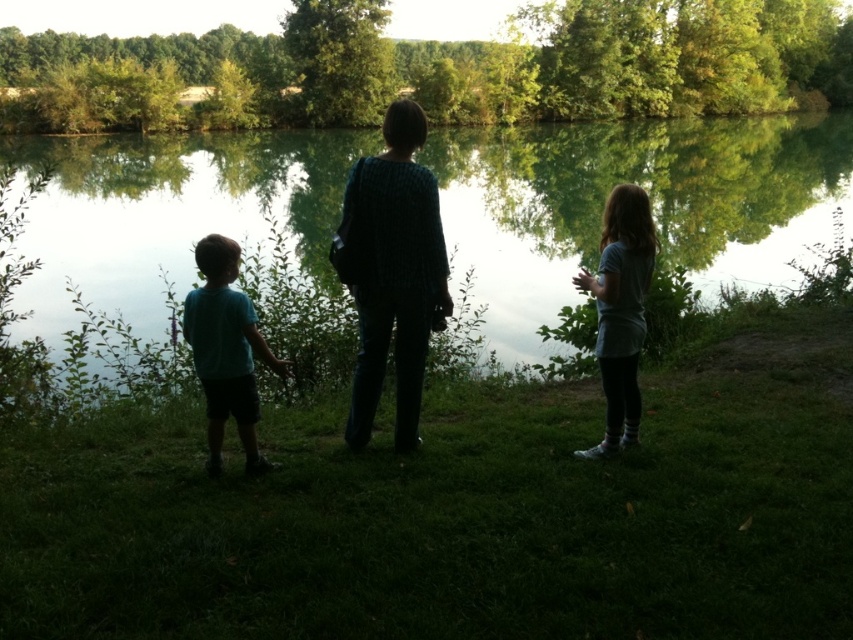
Question: Which object appears closest to the camera in this image?

Choices:
 (A) green reflective water at center
 (B) dark green textured sweater at center
 (C) matte teal shirt at left

Answer: (C)

Question: Is green reflective water at center to the left of dark green textured sweater at center from the viewer's perspective?

Choices:
 (A) no
 (B) yes

Answer: (B)

Question: Can you confirm if green reflective water at center is positioned to the left of dark green textured sweater at center?

Choices:
 (A) yes
 (B) no

Answer: (A)

Question: Does dark green textured sweater at center come behind matte teal shirt at left?

Choices:
 (A) no
 (B) yes

Answer: (B)

Question: Which point is closer to the camera?

Choices:
 (A) (456, 166)
 (B) (349, 278)

Answer: (B)

Question: Which object is positioned farthest from the matte teal shirt at left?

Choices:
 (A) green reflective water at center
 (B) dark green textured sweater at center

Answer: (A)